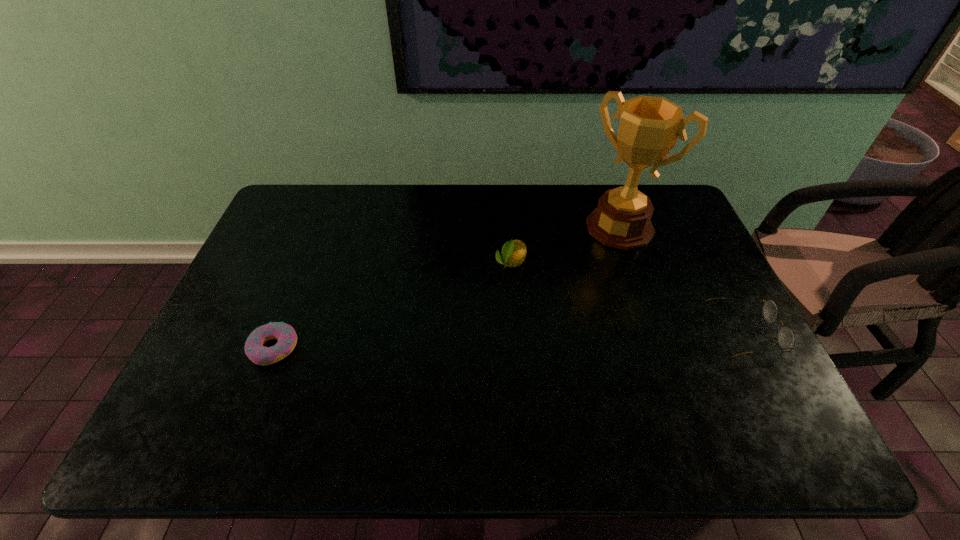
The image size is (960, 540). Identify the location of the leftmost object. (285, 334).

You are a GUI agent. You are given a task and a screenshot of the screen. Output one action in this format:
    pyautogui.click(x=<x>, y=<y>)
    Task: Click on the shortest object
    The width and height of the screenshot is (960, 540).
    Given the screenshot: What is the action you would take?
    pyautogui.click(x=285, y=334)

This screenshot has width=960, height=540. Identify the location of spectacles. coord(785,336).

The image size is (960, 540). I want to click on the rightmost object, so click(x=785, y=336).

This screenshot has height=540, width=960. I want to click on the second object from right to left, so click(649, 127).

Where is `award`? Image resolution: width=960 pixels, height=540 pixels. award is located at coordinates (649, 127).

At what (x,y) coordinates should I click in order to perform the action: click on the third nearest object. Please return your answer as a coordinate pair (x, y). This screenshot has height=540, width=960. Looking at the image, I should click on (513, 253).

You are a GUI agent. You are given a task and a screenshot of the screen. Output one action in this format:
    pyautogui.click(x=<x>, y=<y>)
    Task: Click on the lemon
    This screenshot has width=960, height=540.
    Given the screenshot: What is the action you would take?
    pyautogui.click(x=513, y=253)

In order to click on free space located 0.100m on the left of the shortest object in this screenshot , I will do `click(208, 349)`.

The height and width of the screenshot is (540, 960). What are the coordinates of `vacant space situated 0.170m on the front-facing side of the second object from right to left` in the screenshot? It's located at (576, 276).